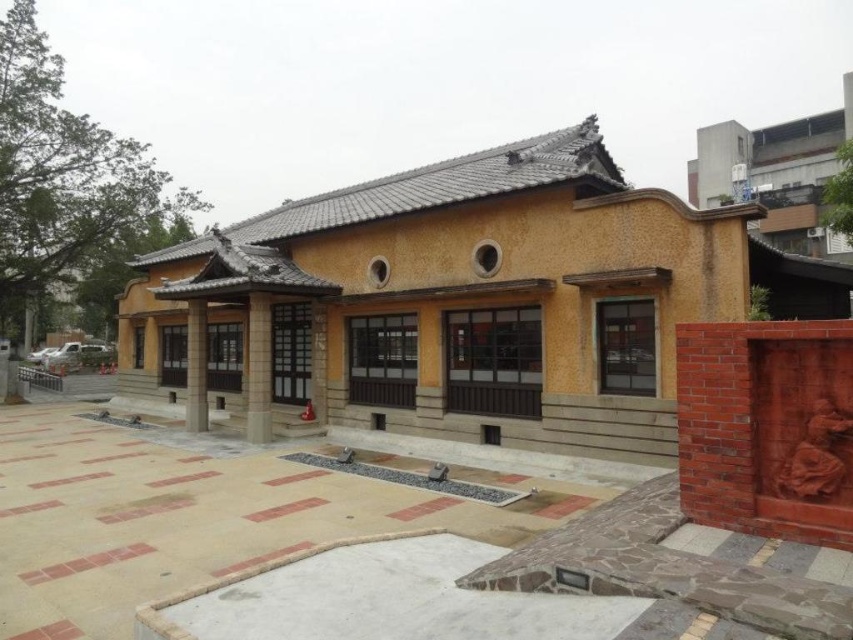
Does smooth stone column at center have a lesser width compared to smooth concrete pillar at center?

Indeed, smooth stone column at center has a lesser width compared to smooth concrete pillar at center.

Does point (270, 310) come in front of point (187, 365)?

Yes, point (270, 310) is in front of point (187, 365).

Describe the element at coordinates (258, 369) in the screenshot. The width and height of the screenshot is (853, 640). I see `smooth stone column at center` at that location.

At what (x,y) coordinates should I click in order to perform the action: click on smooth stone column at center. Please return your answer as a coordinate pair (x, y). Looking at the image, I should click on (258, 369).